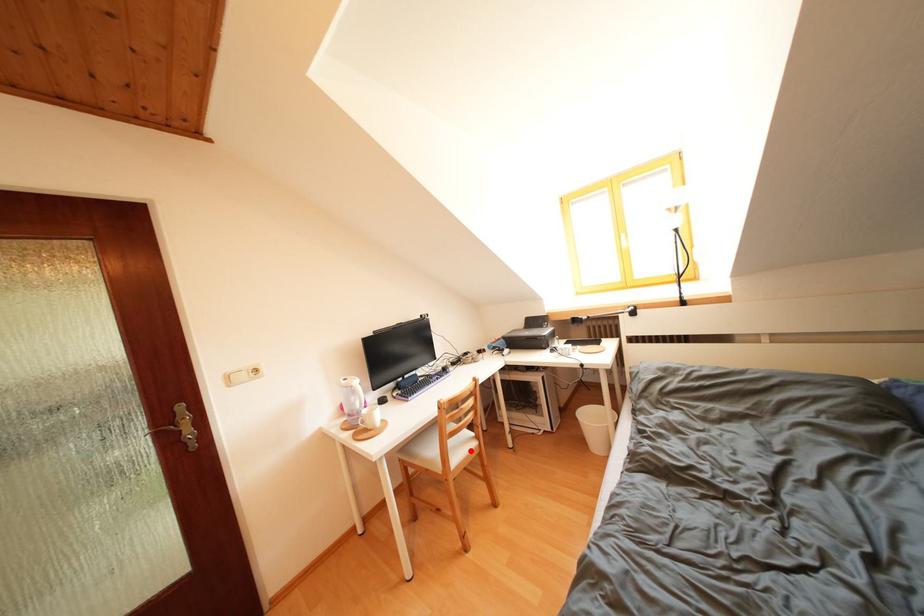
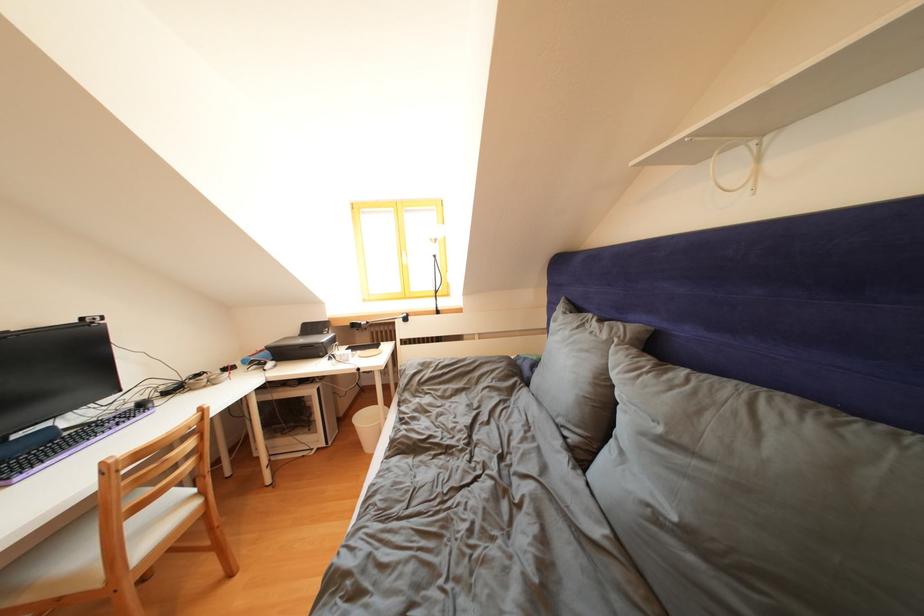
Question: I am providing you with two images of the same scene from different viewpoints. In image1, a red point is highlighted. Considering the same 3D point in image2, which of the following is correct?

Choices:
 (A) It is closer
 (B) It is farther

Answer: (A)